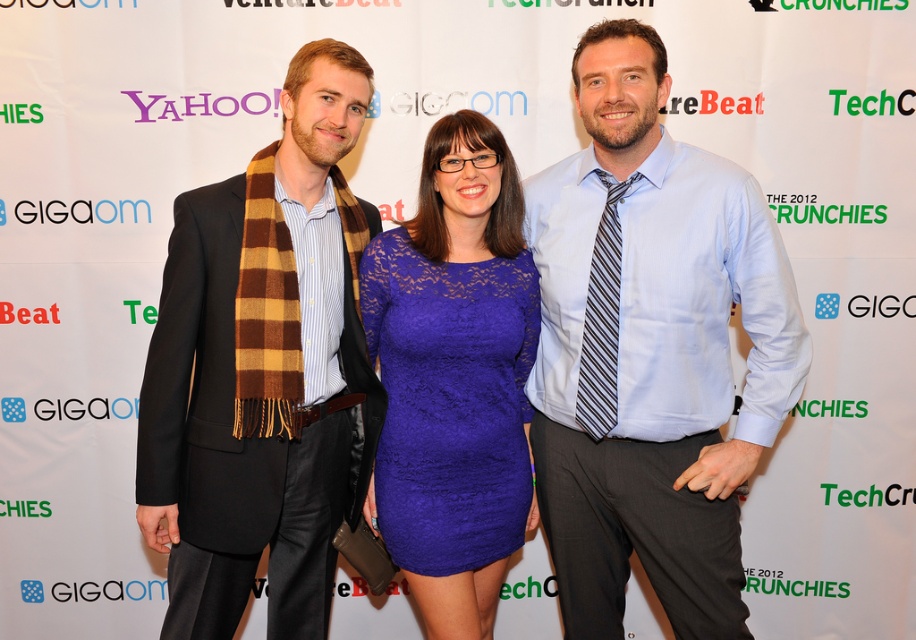
Looking at this image, can you confirm if light blue shirt at center is wider than brown plaid scarf at left?

Indeed, light blue shirt at center has a greater width compared to brown plaid scarf at left.

Does light blue shirt at center come in front of brown plaid scarf at left?

No, it is behind brown plaid scarf at left.

The image size is (916, 640). What are the coordinates of `light blue shirt at center` in the screenshot? It's located at click(x=650, y=349).

Where is `light blue shirt at center`? The image size is (916, 640). light blue shirt at center is located at coordinates (650, 349).

Is brown plaid scarf at left to the left of lace blue dress at center from the viewer's perspective?

Indeed, brown plaid scarf at left is positioned on the left side of lace blue dress at center.

Describe the element at coordinates (263, 371) in the screenshot. I see `brown plaid scarf at left` at that location.

Locate an element on the screen. The width and height of the screenshot is (916, 640). brown plaid scarf at left is located at coordinates (263, 371).

Does light blue shirt at center have a lesser width compared to lace blue dress at center?

In fact, light blue shirt at center might be wider than lace blue dress at center.

Between light blue shirt at center and lace blue dress at center, which one has less height?

Standing shorter between the two is lace blue dress at center.

Locate an element on the screen. Image resolution: width=916 pixels, height=640 pixels. light blue shirt at center is located at coordinates (650, 349).